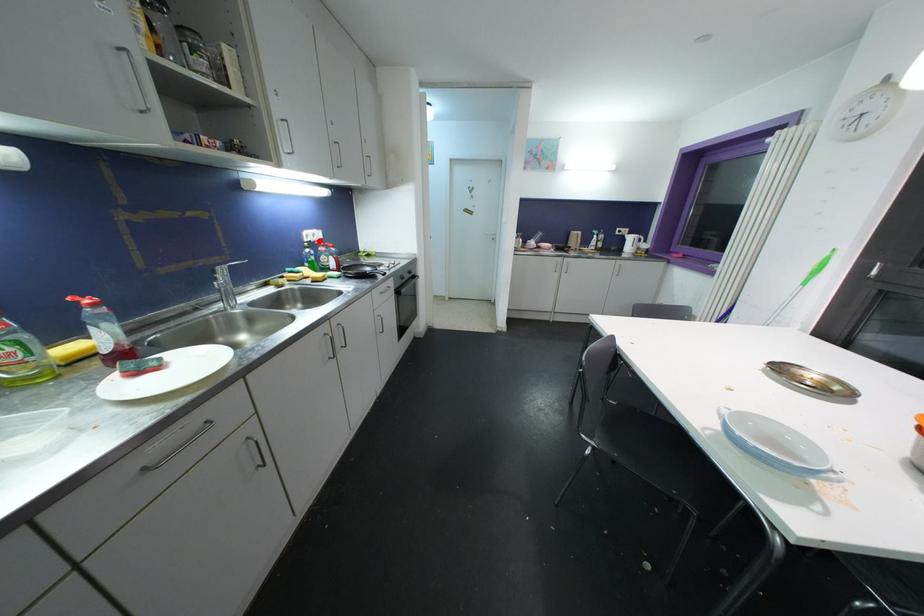
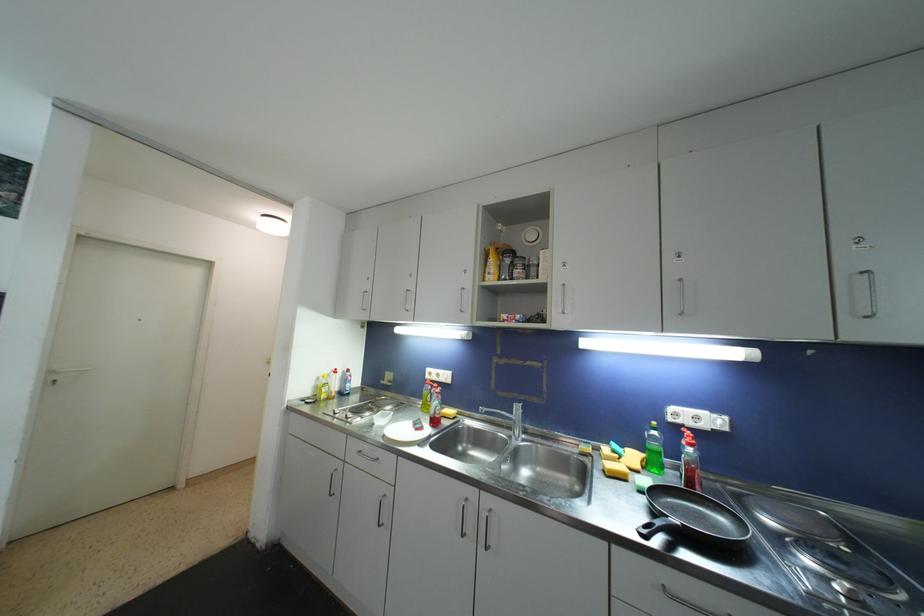
Question: I am providing you with two images of the same scene from different viewpoints. In image1, a red point is highlighted. Considering the same 3D point in image2, which of the following is correct?

Choices:
 (A) It is closer
 (B) It is farther

Answer: (B)